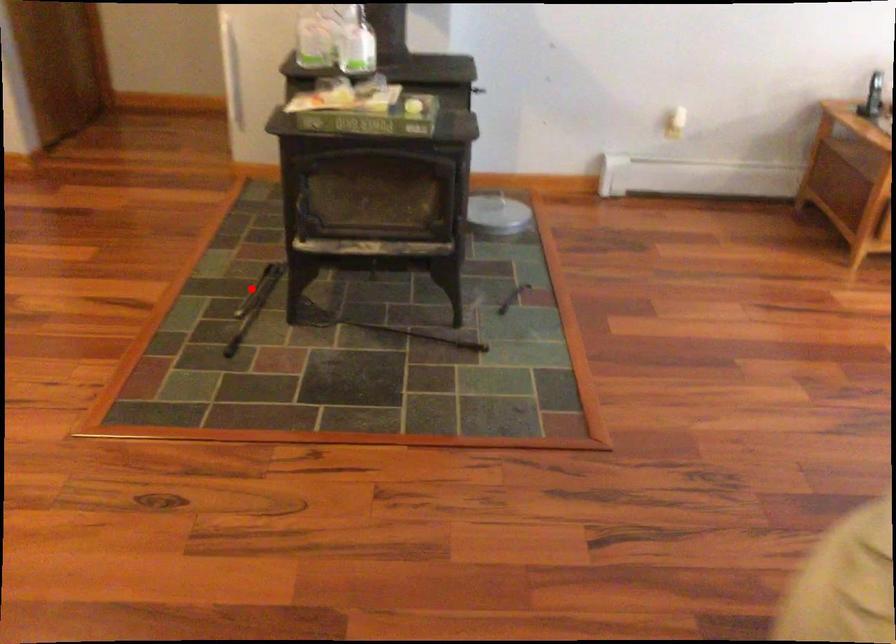
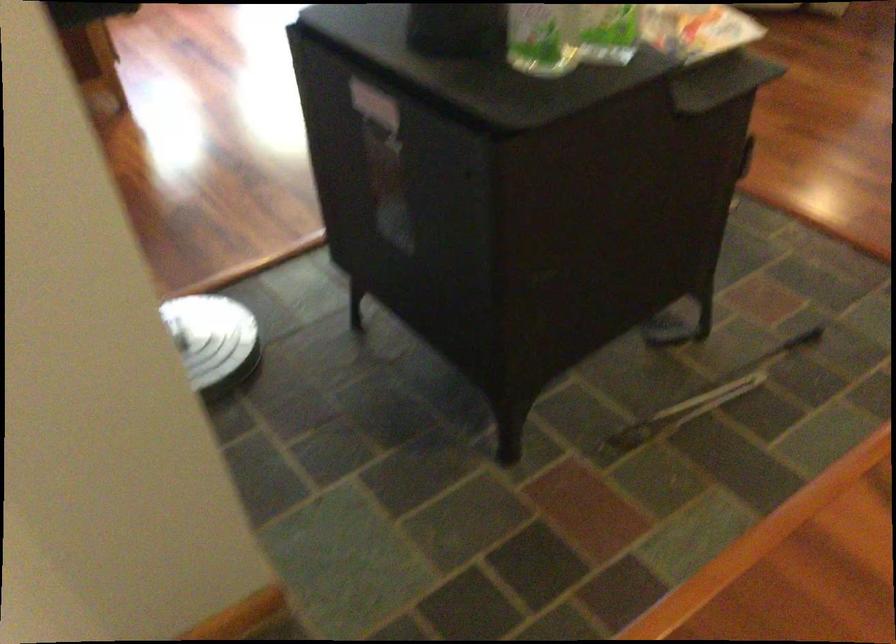
Question: I am providing you with two images of the same scene from different viewpoints. A red point is marked on the first image. At the location where the point appears in image 1, is it still visible in image 2?

Choices:
 (A) Yes
 (B) No

Answer: (A)